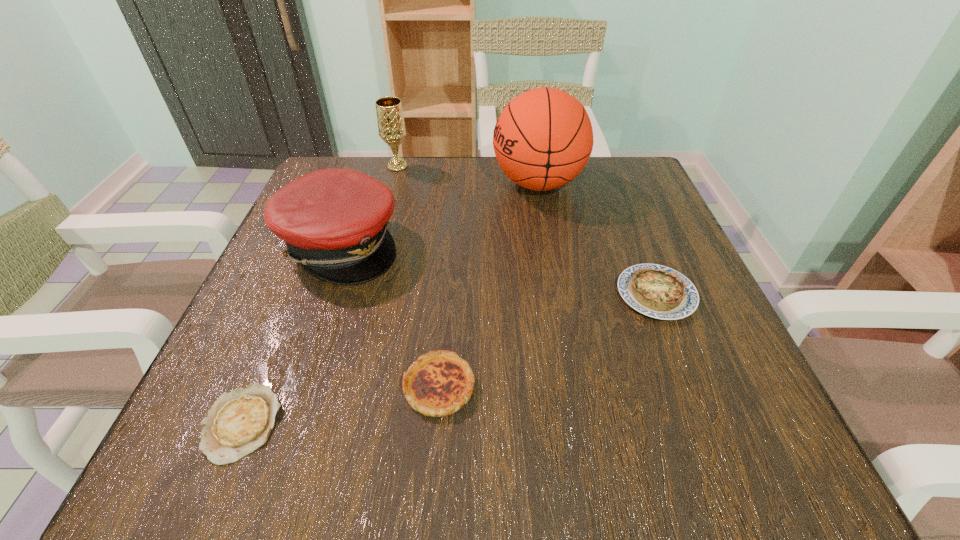
This screenshot has width=960, height=540. I want to click on unoccupied area between the chalice and the leftmost quiche, so click(x=319, y=295).

Point out which object is positioned as the second nearest to the leftmost quiche. Please provide its 2D coordinates. Your answer should be formatted as a tuple, i.e. [(x, y)], where the tuple contains the x and y coordinates of a point satisfying the conditions above.

[(334, 221)]

Locate an element on the screen. This screenshot has height=540, width=960. object that stands as the closest to the fourth shortest object is located at coordinates (391, 126).

What are the coordinates of `quiche that is the third closest to the basketball` in the screenshot? It's located at click(x=239, y=422).

Locate an element on the screen. This screenshot has width=960, height=540. the closest quiche relative to the fifth shortest object is located at coordinates (657, 291).

This screenshot has width=960, height=540. Identify the location of vacant space that satisfies the following two spatial constraints: 1. on the front side of the chalice; 2. on the front-facing side of the cap. (376, 245).

Where is `free location that satisfies the following two spatial constraints: 1. on the back side of the farthest quiche; 2. on the front-facing side of the third tallest object`? free location that satisfies the following two spatial constraints: 1. on the back side of the farthest quiche; 2. on the front-facing side of the third tallest object is located at coordinates (636, 245).